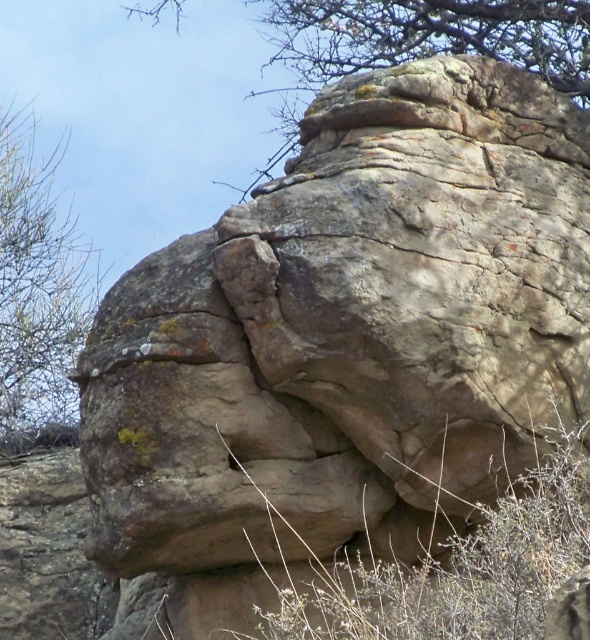
The image size is (590, 640). Describe the element at coordinates (349, 326) in the screenshot. I see `gray rough rock at center` at that location.

Does gray rough rock at center appear on the left side of green mossy rock at upper center?

Indeed, gray rough rock at center is positioned on the left side of green mossy rock at upper center.

Does point (444, 230) lie behind point (419, 45)?

No, it is not.

This screenshot has height=640, width=590. What are the coordinates of `gray rough rock at center` in the screenshot? It's located at (349, 326).

Which of these two, gray rough rock at center or green leafy tree at upper left, stands shorter?

With less height is gray rough rock at center.

At what (x,y) coordinates should I click in order to perform the action: click on gray rough rock at center. Please return your answer as a coordinate pair (x, y). The height and width of the screenshot is (640, 590). Looking at the image, I should click on (349, 326).

Between green mossy rock at upper center and green leafy tree at upper left, which one has less height?

green mossy rock at upper center is shorter.

Who is positioned more to the left, green mossy rock at upper center or green leafy tree at upper left?

From the viewer's perspective, green leafy tree at upper left appears more on the left side.

Which is behind, point (458, 8) or point (90, 259)?

Point (90, 259)

This screenshot has height=640, width=590. I want to click on green mossy rock at upper center, so click(x=419, y=42).